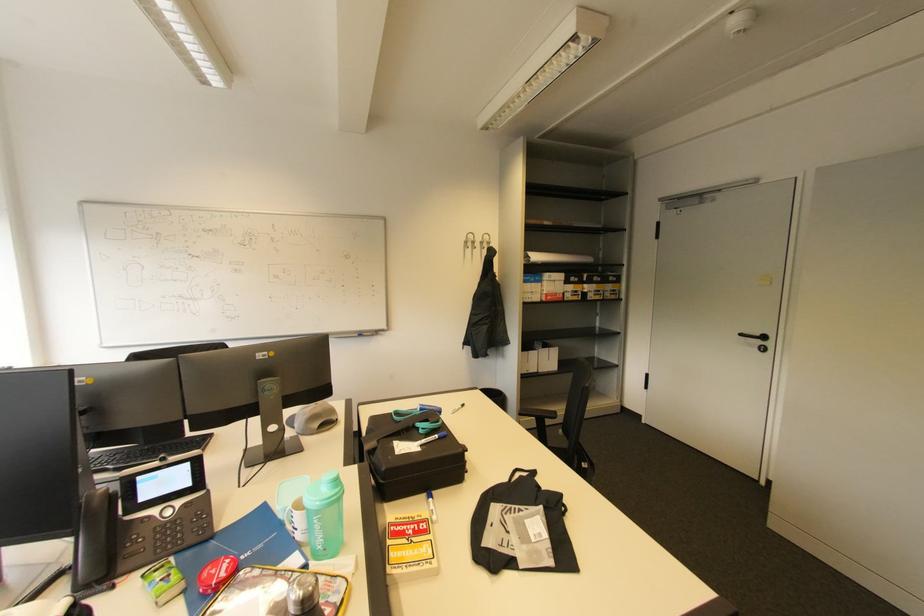
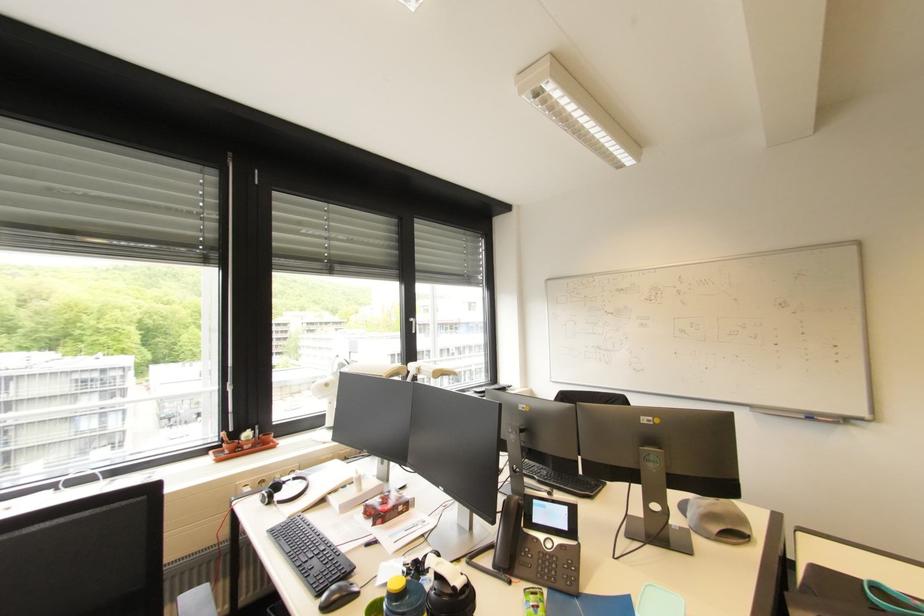
Locate, in the second image, the point that corresponds to [361,336] in the first image.

(808, 418)